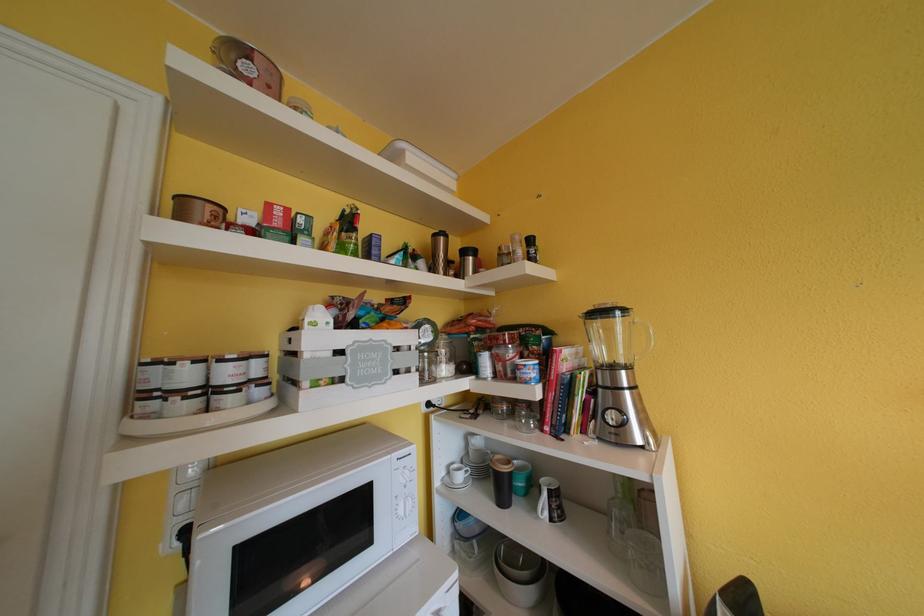
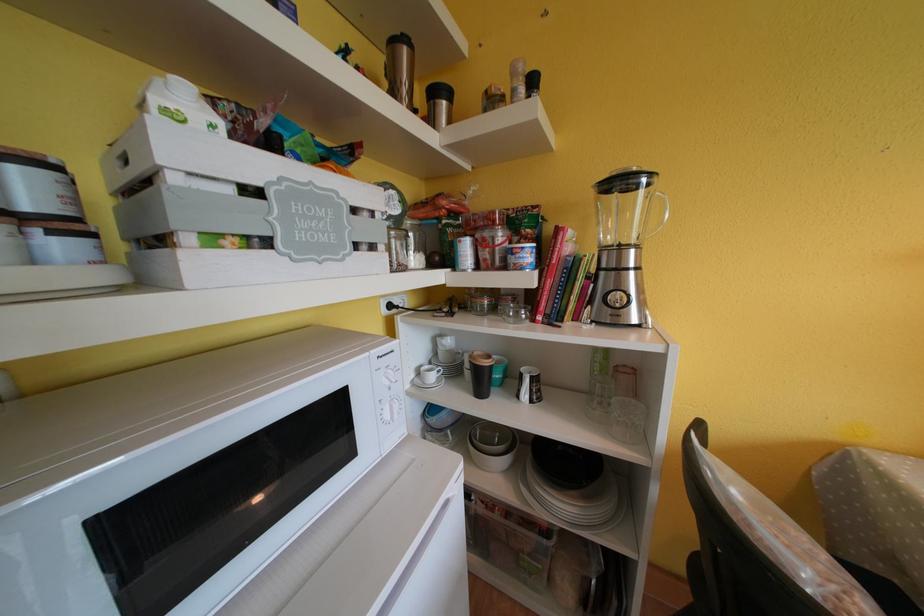
The point at [467,480] is marked in the first image. Where is the corresponding point in the second image?

(439, 381)